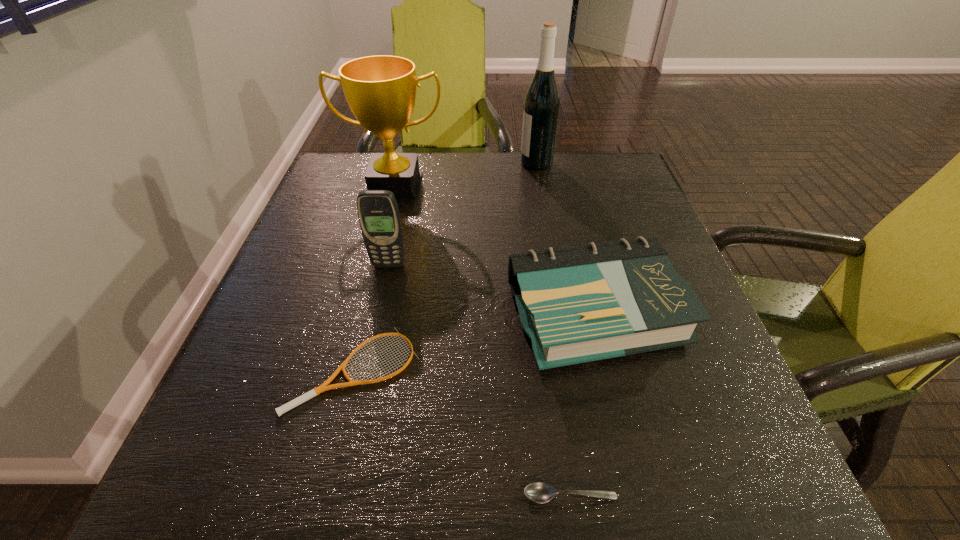
This screenshot has width=960, height=540. Identify the location of free spot that satisfies the following two spatial constraints: 1. on the front-facing side of the third shortest object; 2. on the right side of the second tallest object. coord(362,314).